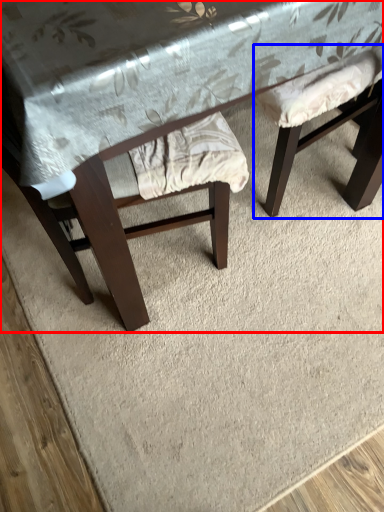
Question: Which of the following is the closest to the observer, table (highlighted by a red box) or swivel chair (highlighted by a blue box)?

Choices:
 (A) table
 (B) swivel chair

Answer: (A)